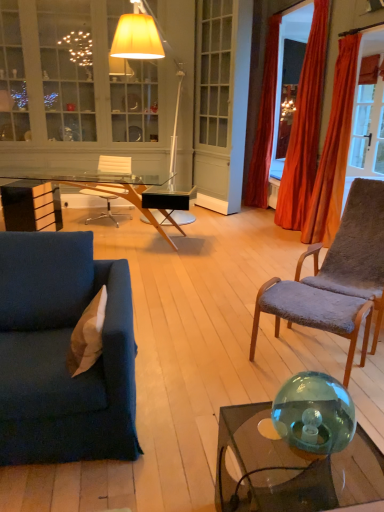
Question: From a real-world perspective, is velvet orange curtain at right, positioned as the first curtain in back-to-front order, physically located above or below matte white floor lamp at upper center?

Choices:
 (A) above
 (B) below

Answer: (A)

Question: Looking at the image, does velvet orange curtain at right, positioned as the first curtain in back-to-front order, seem bigger or smaller compared to matte white floor lamp at upper center?

Choices:
 (A) big
 (B) small

Answer: (B)

Question: Which object is positioned farthest from the tan suede pillow at left?

Choices:
 (A) velvet orange curtain at right, marked as the third curtain in a front-to-back arrangement
 (B) velvet blue couch at lower left
 (C) transparent glass sphere at lower right
 (D) matte white cabinet at upper left
 (E) clear plastic chair at center, the second chair from the right

Answer: (D)

Question: Estimate the real-world distances between objects in this image. Which object is farther from the matte white floor lamp at upper center?

Choices:
 (A) velvet blue couch at lower left
 (B) matte white cabinet at upper left
 (C) transparent glass desk at center
 (D) gray plush chair at right, the 2th chair from the left
 (E) transparent glass coffee table at lower right

Answer: (E)